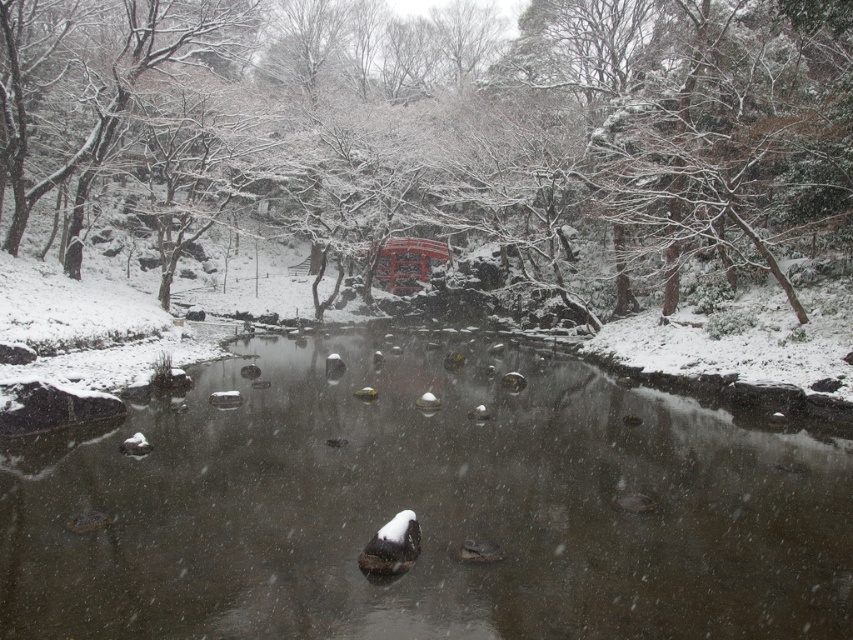
Who is positioned more to the left, smooth stone river at center or snow-covered tree at center?

snow-covered tree at center

Is point (692, 416) positioned in front of point (769, 12)?

Yes, it is.

Where is `smooth stone river at center`? smooth stone river at center is located at coordinates (426, 509).